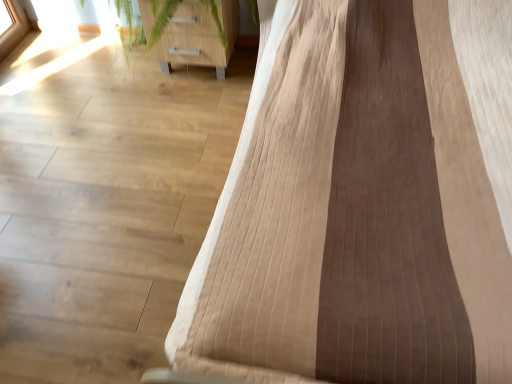
Identify the location of brown textured fabric at right, which is counted as the second furniture, starting from the left. (360, 206).

Image resolution: width=512 pixels, height=384 pixels. Describe the element at coordinates (360, 206) in the screenshot. I see `brown textured fabric at right, the first furniture when ordered from right to left` at that location.

The width and height of the screenshot is (512, 384). What do you see at coordinates (199, 36) in the screenshot?
I see `wooden cabinet at upper left, which appears as the 1th furniture when viewed from the left` at bounding box center [199, 36].

This screenshot has width=512, height=384. What are the coordinates of `wooden cabinet at upper left, which appears as the 1th furniture when viewed from the left` in the screenshot? It's located at (199, 36).

Locate an element on the screen. Image resolution: width=512 pixels, height=384 pixels. brown textured fabric at right, which is counted as the second furniture, starting from the left is located at coordinates (360, 206).

Would you say wooden cabinet at upper left, which appears as the 1th furniture when viewed from the left, is to the left or to the right of brown textured fabric at right, which is counted as the second furniture, starting from the left, in the picture?

In the image, wooden cabinet at upper left, which appears as the 1th furniture when viewed from the left, appears on the left side of brown textured fabric at right, which is counted as the second furniture, starting from the left.

Which object is further away from the camera, wooden cabinet at upper left, which is the 2th furniture from right to left, or brown textured fabric at right, which is counted as the second furniture, starting from the left?

wooden cabinet at upper left, which is the 2th furniture from right to left, is behind.

Is point (210, 19) positioned after point (267, 145)?

Yes.

From the image's perspective, between wooden cabinet at upper left, which appears as the 1th furniture when viewed from the left, and brown textured fabric at right, which is counted as the second furniture, starting from the left, who is located below?

brown textured fabric at right, which is counted as the second furniture, starting from the left, appears lower in the image.

From a real-world perspective, which object rests below the other?

wooden cabinet at upper left, which appears as the 1th furniture when viewed from the left.

In terms of width, does wooden cabinet at upper left, which appears as the 1th furniture when viewed from the left, look wider or thinner when compared to brown textured fabric at right, which is counted as the second furniture, starting from the left?

wooden cabinet at upper left, which appears as the 1th furniture when viewed from the left, is thinner than brown textured fabric at right, which is counted as the second furniture, starting from the left.

Consider the image. Does wooden cabinet at upper left, which is the 2th furniture from right to left, have a lesser height compared to brown textured fabric at right, the first furniture when ordered from right to left?

Correct, wooden cabinet at upper left, which is the 2th furniture from right to left, is not as tall as brown textured fabric at right, the first furniture when ordered from right to left.

Considering the sizes of objects wooden cabinet at upper left, which appears as the 1th furniture when viewed from the left, and brown textured fabric at right, the first furniture when ordered from right to left, in the image provided, who is bigger, wooden cabinet at upper left, which appears as the 1th furniture when viewed from the left, or brown textured fabric at right, the first furniture when ordered from right to left,?

brown textured fabric at right, the first furniture when ordered from right to left, is bigger.

Is brown textured fabric at right, the first furniture when ordered from right to left, located within wooden cabinet at upper left, which appears as the 1th furniture when viewed from the left?

Actually, brown textured fabric at right, the first furniture when ordered from right to left, is outside wooden cabinet at upper left, which appears as the 1th furniture when viewed from the left.

Is wooden cabinet at upper left, which is the 2th furniture from right to left, not close to brown textured fabric at right, the first furniture when ordered from right to left?

That's right, there is a large distance between wooden cabinet at upper left, which is the 2th furniture from right to left, and brown textured fabric at right, the first furniture when ordered from right to left.

Is wooden cabinet at upper left, which is the 2th furniture from right to left, looking in the opposite direction of brown textured fabric at right, the first furniture when ordered from right to left?

wooden cabinet at upper left, which is the 2th furniture from right to left, does not have its back to brown textured fabric at right, the first furniture when ordered from right to left.

How different are the orientations of wooden cabinet at upper left, which appears as the 1th furniture when viewed from the left, and brown textured fabric at right, the first furniture when ordered from right to left, in degrees?

There is a 0.411-degree angle between the facing directions of wooden cabinet at upper left, which appears as the 1th furniture when viewed from the left, and brown textured fabric at right, the first furniture when ordered from right to left.

Where is `furniture below the wooden cabinet at upper left, which appears as the 1th furniture when viewed from the left (from the image's perspective)`? This screenshot has width=512, height=384. furniture below the wooden cabinet at upper left, which appears as the 1th furniture when viewed from the left (from the image's perspective) is located at coordinates (360, 206).

Is brown textured fabric at right, which is counted as the second furniture, starting from the left, at the left side of wooden cabinet at upper left, which appears as the 1th furniture when viewed from the left?

Incorrect, brown textured fabric at right, which is counted as the second furniture, starting from the left, is not on the left side of wooden cabinet at upper left, which appears as the 1th furniture when viewed from the left.

Is the depth of brown textured fabric at right, the first furniture when ordered from right to left, greater than that of wooden cabinet at upper left, which is the 2th furniture from right to left?

That is False.

Which is nearer, (348, 63) or (195, 37)?

The point (348, 63) is closer to the camera.

From the image's perspective, which is below, brown textured fabric at right, the first furniture when ordered from right to left, or wooden cabinet at upper left, which is the 2th furniture from right to left?

brown textured fabric at right, the first furniture when ordered from right to left, appears lower in the image.

From a real-world perspective, who is located higher, brown textured fabric at right, which is counted as the second furniture, starting from the left, or wooden cabinet at upper left, which is the 2th furniture from right to left?

brown textured fabric at right, which is counted as the second furniture, starting from the left, from a real-world perspective.

Which of these two, brown textured fabric at right, which is counted as the second furniture, starting from the left, or wooden cabinet at upper left, which is the 2th furniture from right to left, is wider?

brown textured fabric at right, which is counted as the second furniture, starting from the left.

Consider the image. Considering the sizes of objects brown textured fabric at right, which is counted as the second furniture, starting from the left, and wooden cabinet at upper left, which appears as the 1th furniture when viewed from the left, in the image provided, who is shorter, brown textured fabric at right, which is counted as the second furniture, starting from the left, or wooden cabinet at upper left, which appears as the 1th furniture when viewed from the left,?

With less height is wooden cabinet at upper left, which appears as the 1th furniture when viewed from the left.

Between brown textured fabric at right, which is counted as the second furniture, starting from the left, and wooden cabinet at upper left, which appears as the 1th furniture when viewed from the left, which one has larger size?

brown textured fabric at right, which is counted as the second furniture, starting from the left, is bigger.

Choose the correct answer: Is brown textured fabric at right, which is counted as the second furniture, starting from the left, inside wooden cabinet at upper left, which is the 2th furniture from right to left, or outside it?

brown textured fabric at right, which is counted as the second furniture, starting from the left, is outside wooden cabinet at upper left, which is the 2th furniture from right to left.

Is brown textured fabric at right, the first furniture when ordered from right to left, in contact with wooden cabinet at upper left, which is the 2th furniture from right to left?

They are not placed beside each other.

Is brown textured fabric at right, the first furniture when ordered from right to left, positioned with its back to wooden cabinet at upper left, which is the 2th furniture from right to left?

No, brown textured fabric at right, the first furniture when ordered from right to left,'s orientation is not away from wooden cabinet at upper left, which is the 2th furniture from right to left.

How many degrees apart are the facing directions of brown textured fabric at right, which is counted as the second furniture, starting from the left, and wooden cabinet at upper left, which is the 2th furniture from right to left?

Answer: There is a 0.411-degree angle between the facing directions of brown textured fabric at right, which is counted as the second furniture, starting from the left, and wooden cabinet at upper left, which is the 2th furniture from right to left.

How distant is brown textured fabric at right, the first furniture when ordered from right to left, from wooden cabinet at upper left, which is the 2th furniture from right to left?

brown textured fabric at right, the first furniture when ordered from right to left, is 1.01 meters from wooden cabinet at upper left, which is the 2th furniture from right to left.

The width and height of the screenshot is (512, 384). There is a wooden cabinet at upper left, which is the 2th furniture from right to left. Identify the location of furniture above it (from a real-world perspective). (360, 206).

What are the coordinates of `furniture behind the brown textured fabric at right, which is counted as the second furniture, starting from the left` in the screenshot? It's located at (199, 36).

Locate an element on the screen. This screenshot has height=384, width=512. furniture in front of the wooden cabinet at upper left, which is the 2th furniture from right to left is located at coordinates (360, 206).